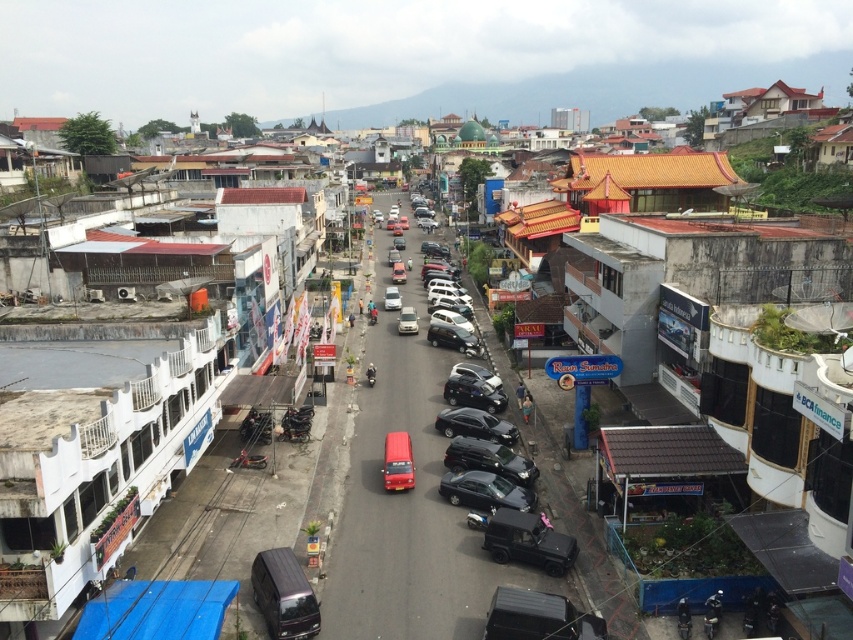
You are a delivery driver who needs to know if your 2.5 meters tall cargo can pass under the bridge ahead. You see a metallic black van at center and a matte white van at center. Which van is shorter and can safely pass under the bridge?

The metallic black van at center has a lesser height compared to matte white van at center, so the metallic black van at center can safely pass under the bridge since it is shorter than the matte white van at center.

You are a delivery driver who needs to park your matte silver van at center in a parking spot that is exactly the same length as your vehicle. There is also a matte white van at center parked nearby. Which van should you use as a reference for the required parking spot length?

The matte silver van at center is shorter than the matte white van at center, so you should use the matte silver van at center as a reference for the parking spot length since it matches your vehicle size.

You are a delivery driver who needs to park your metallic black van at center in a space that can only accommodate vehicles smaller than the matte white van at center. Is your van suitable for the parking space?

The metallic black van at center has a smaller size compared to the matte white van at center, so yes, the metallic black van at center is suitable for the parking space since it is smaller than the matte white van at center.